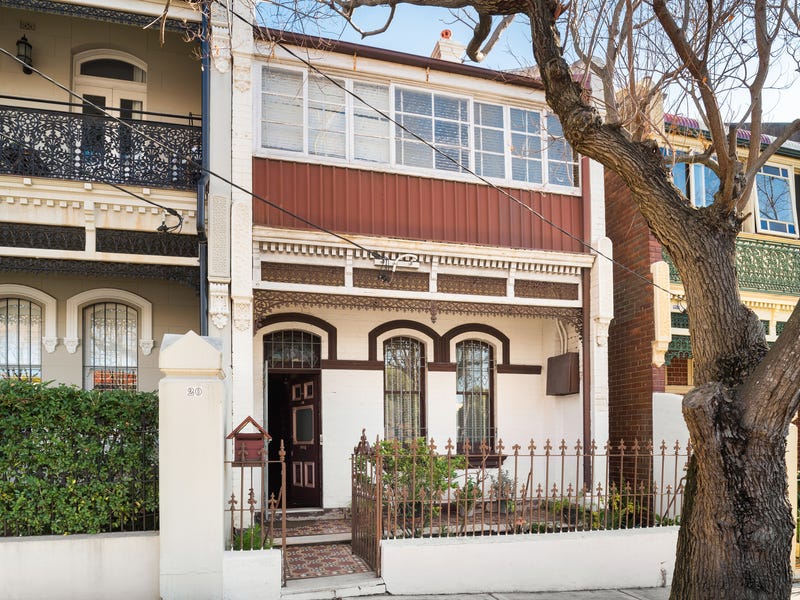
Identify the location of iron. The width and height of the screenshot is (800, 600). (464, 517).